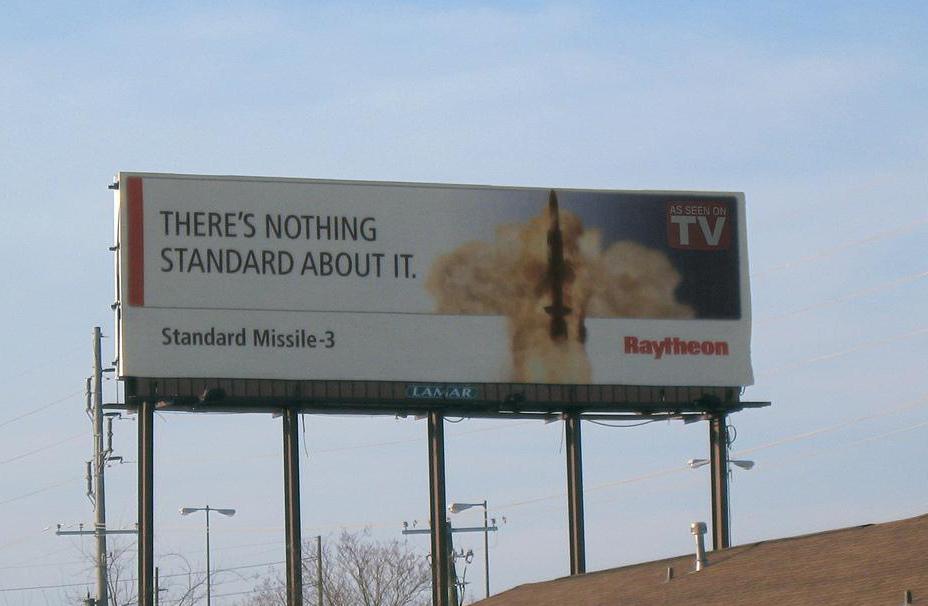
Identify the location of tv. This screenshot has width=928, height=606. (679, 222).